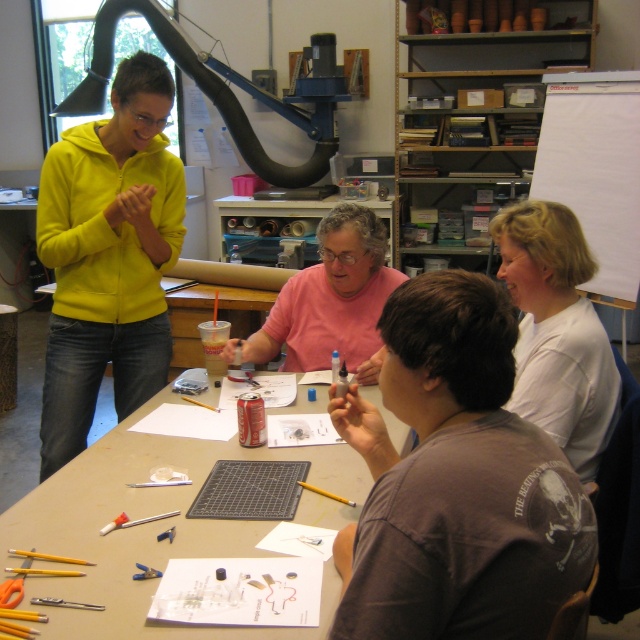
You are organizing a clothing donation drive and need to categorize items by size. You have a matte yellow hoodie at upper left and a pink cotton shirt at center. Which item should you place in the large size bin?

The matte yellow hoodie at upper left should be placed in the large size bin because it is larger in size than the pink cotton shirt at center.

You are organizing a clothing donation drive and need to sort shirts by size. You have a dark brown cotton shirt at center and a white matte shirt at upper right. Which shirt should you place in the small size bin?

The dark brown cotton shirt at center has a smaller size compared to the white matte shirt at upper right, so it should be placed in the small size bin.